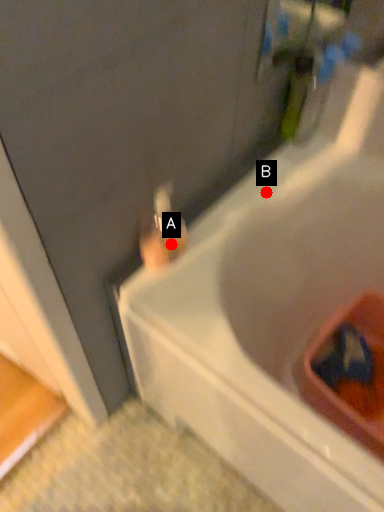
Question: Two points are circled on the image, labeled by A and B beside each circle. Which of the following is the closest to the observer?

Choices:
 (A) A is closer
 (B) B is closer

Answer: (A)